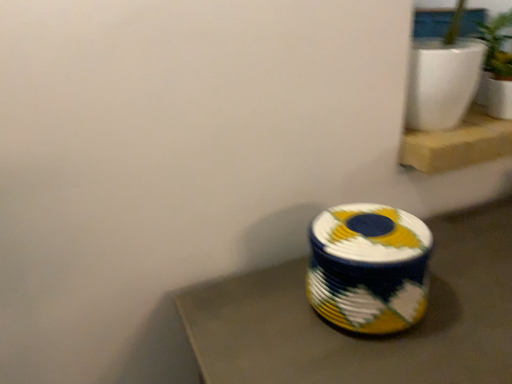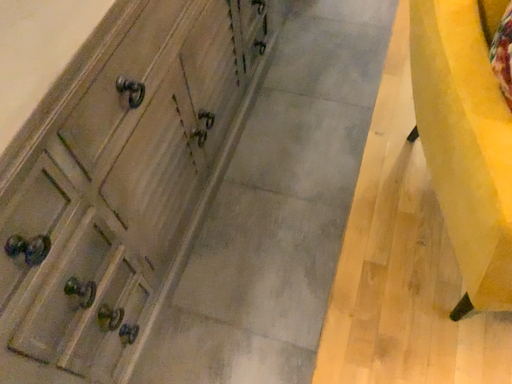
Question: How did the camera likely rotate when shooting the video?

Choices:
 (A) rotated left
 (B) rotated right

Answer: (B)